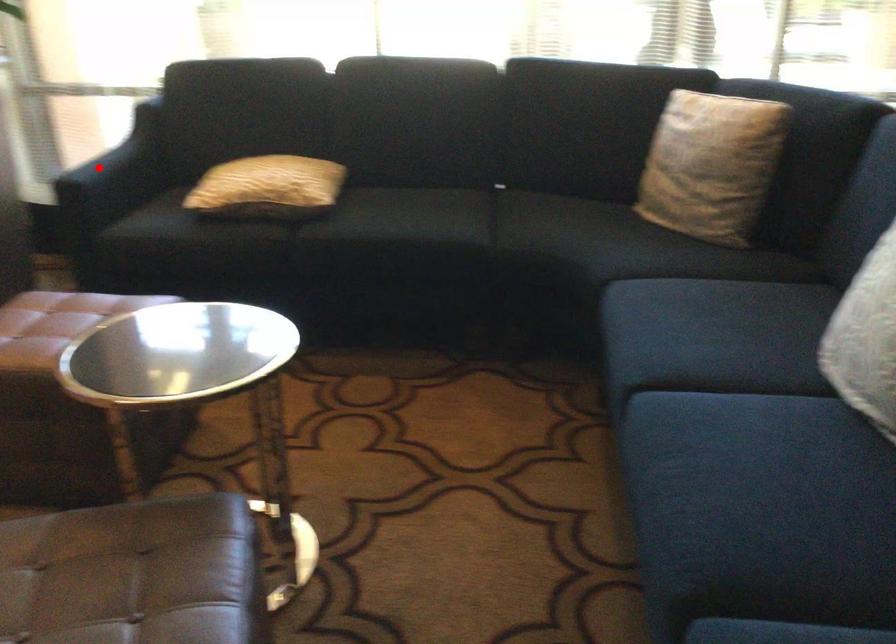
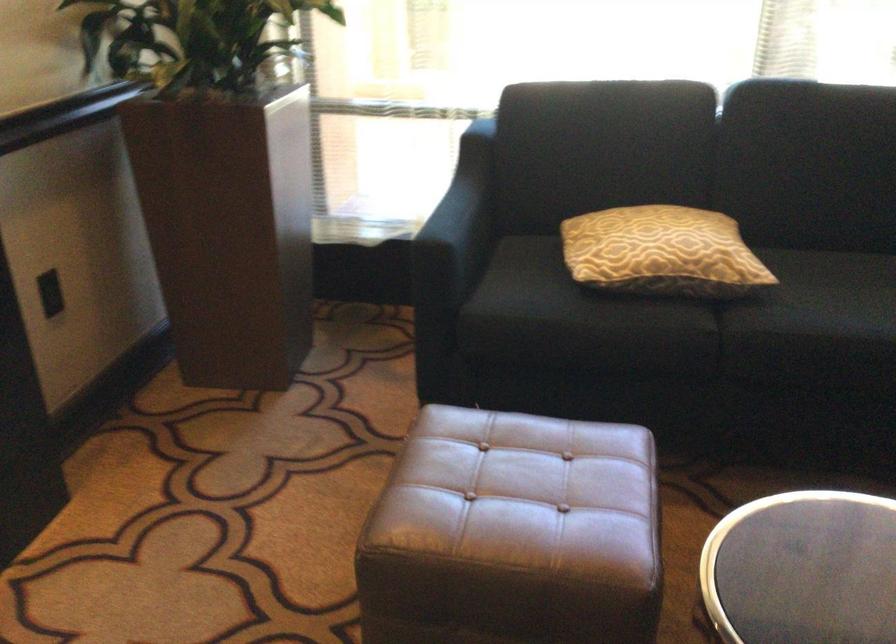
Find the pixel in the second image that matches the highlighted location in the first image.

(458, 225)